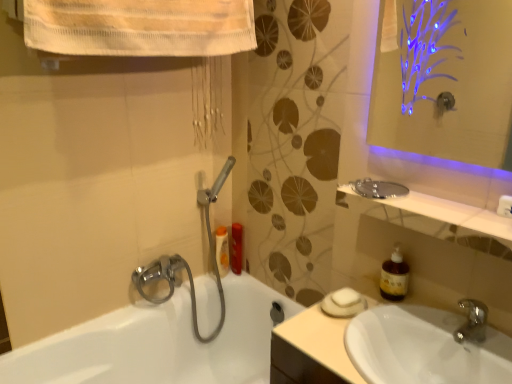
Identify the location of free space to the left of brown translucent soap dispenser at right. The width and height of the screenshot is (512, 384). (354, 318).